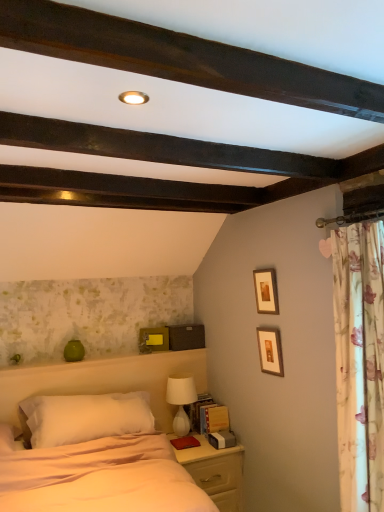
Question: Is light wood nightstand at lower right thinner than yellow matte picture frame at upper center, the first picture frame from the left?

Choices:
 (A) yes
 (B) no

Answer: (B)

Question: Does light wood nightstand at lower right contain yellow matte picture frame at upper center, arranged as the 1th picture frame when viewed from the back?

Choices:
 (A) yes
 (B) no

Answer: (B)

Question: From the image's perspective, is light wood nightstand at lower right located beneath yellow matte picture frame at upper center, the first picture frame from the left?

Choices:
 (A) no
 (B) yes

Answer: (B)

Question: Does light wood nightstand at lower right have a greater height compared to yellow matte picture frame at upper center, the third picture frame in the front-to-back sequence?

Choices:
 (A) yes
 (B) no

Answer: (A)

Question: From the image's perspective, is light wood nightstand at lower right on top of yellow matte picture frame at upper center, which is the 3th picture frame in top-to-bottom order?

Choices:
 (A) no
 (B) yes

Answer: (A)

Question: Is yellow matte picture frame at upper center, the third picture frame in the front-to-back sequence, at the back of light wood nightstand at lower right?

Choices:
 (A) yes
 (B) no

Answer: (B)

Question: From the image's perspective, does yellow matte picture frame at upper center, the third picture frame in the front-to-back sequence, appear higher than white soft bed at center?

Choices:
 (A) yes
 (B) no

Answer: (A)

Question: Would you consider yellow matte picture frame at upper center, positioned as the 3th picture frame in right-to-left order, to be distant from white soft bed at center?

Choices:
 (A) yes
 (B) no

Answer: (B)

Question: Considering the relative sizes of yellow matte picture frame at upper center, positioned as the 3th picture frame in right-to-left order, and white soft bed at center in the image provided, is yellow matte picture frame at upper center, positioned as the 3th picture frame in right-to-left order, wider than white soft bed at center?

Choices:
 (A) no
 (B) yes

Answer: (A)

Question: Is yellow matte picture frame at upper center, which is the 3th picture frame in top-to-bottom order, positioned before white soft bed at center?

Choices:
 (A) yes
 (B) no

Answer: (B)

Question: From a real-world perspective, does yellow matte picture frame at upper center, positioned as the 3th picture frame in right-to-left order, sit lower than white soft bed at center?

Choices:
 (A) yes
 (B) no

Answer: (B)

Question: From a real-world perspective, is yellow matte picture frame at upper center, positioned as the 3th picture frame in right-to-left order, located higher than white soft bed at center?

Choices:
 (A) no
 (B) yes

Answer: (B)

Question: Is yellow matte picture frame at upper center, positioned as the 3th picture frame in right-to-left order, to the right of wooden picture frame at upper center, positioned as the 2th picture frame in left-to-right order, from the viewer's perspective?

Choices:
 (A) yes
 (B) no

Answer: (B)